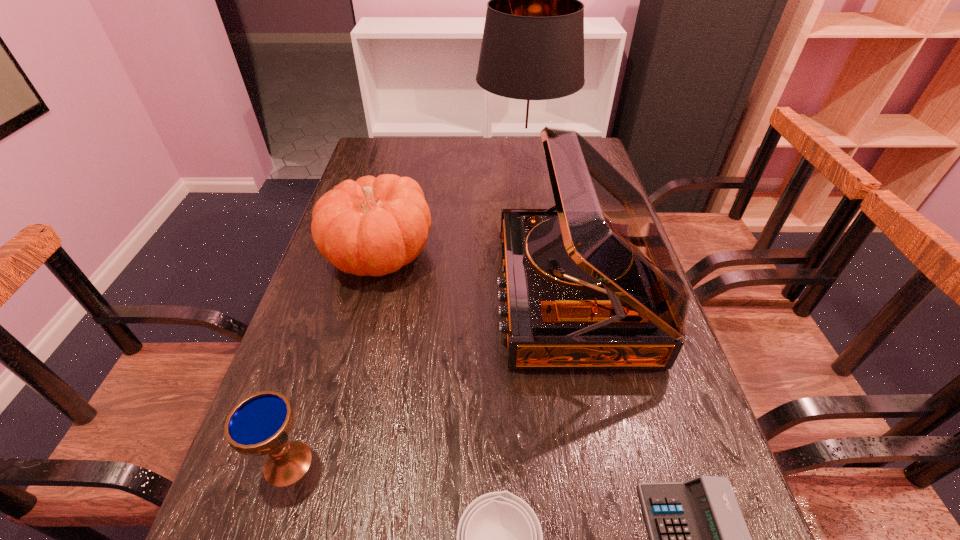
Where is `free location located on the right of the chalice`? Image resolution: width=960 pixels, height=540 pixels. free location located on the right of the chalice is located at coordinates (490, 463).

Identify the location of object located in the far edge section of the desktop. (532, 54).

At what (x,y) coordinates should I click in order to perform the action: click on pumpkin positioned at the left edge. Please return your answer as a coordinate pair (x, y). Looking at the image, I should click on (372, 226).

Where is `chalice located in the left edge section of the desktop`? chalice located in the left edge section of the desktop is located at coordinates (260, 424).

Find the location of a particular element. lampshade at the right edge is located at coordinates (532, 54).

I want to click on record player present at the right edge, so click(589, 283).

You are a GUI agent. You are given a task and a screenshot of the screen. Output one action in this format:
    pyautogui.click(x=<x>, y=<y>)
    Task: Click on the object at the far right corner
    The image size is (960, 540).
    Given the screenshot: What is the action you would take?
    pyautogui.click(x=532, y=54)

In order to click on vacant space at the far edge of the desktop in this screenshot , I will do `click(454, 172)`.

Locate an element on the screen. Image resolution: width=960 pixels, height=540 pixels. vacant space at the left edge of the desktop is located at coordinates (318, 482).

Identify the location of vacant space at the right edge of the desktop. (631, 384).